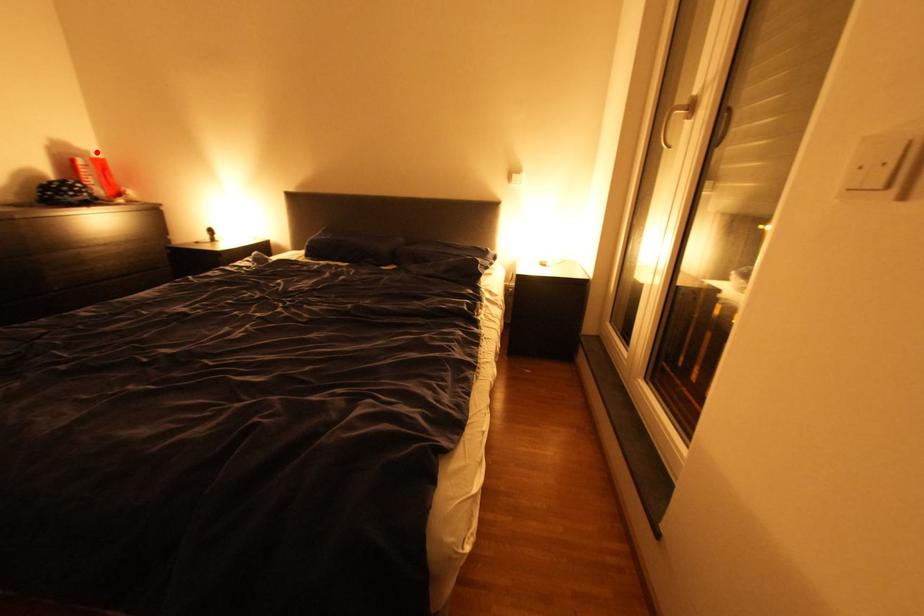
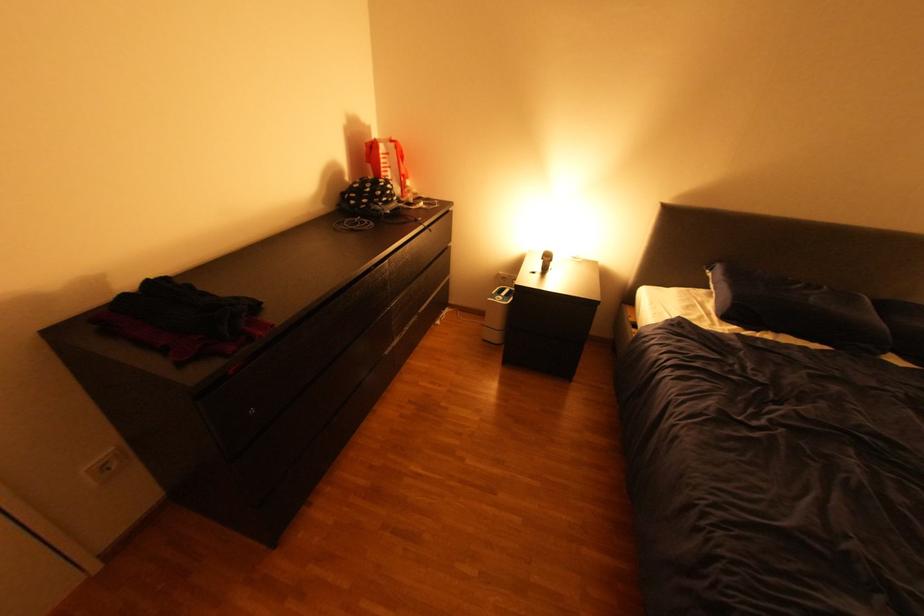
Find the pixel in the second image that matches the highlighted location in the first image.

(379, 129)